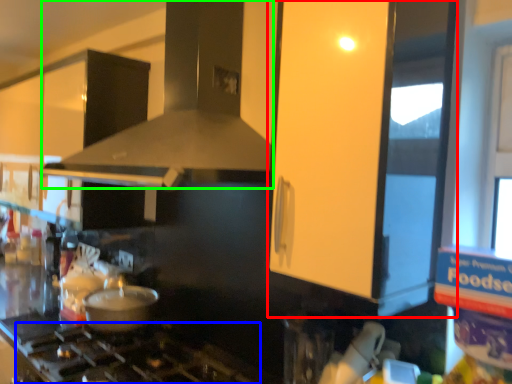
Question: Which is farther away from glass door (highlighted by a red box)? gas stove (highlighted by a blue box) or vent (highlighted by a green box)?

Choices:
 (A) gas stove
 (B) vent

Answer: (A)